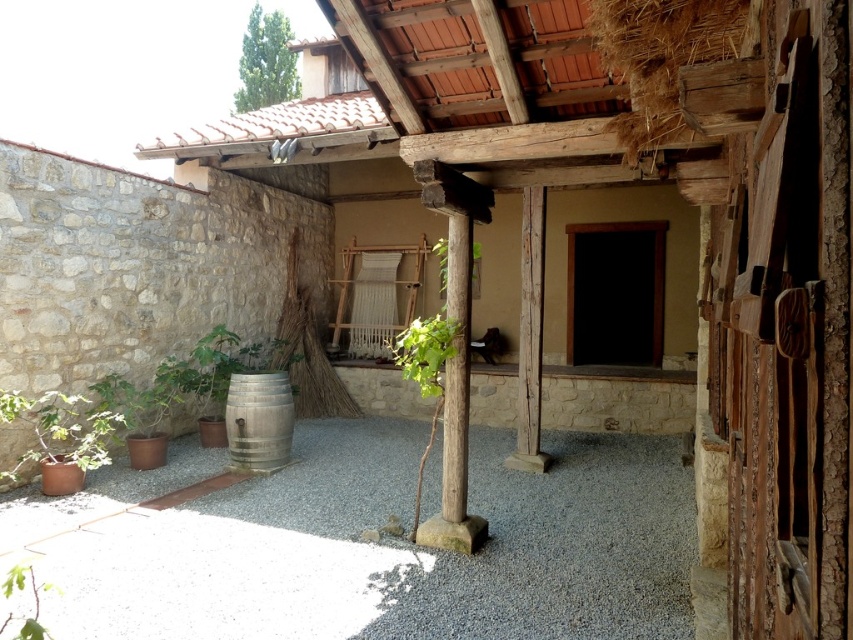
Question: Can you confirm if gray gravel at lower center is wider than green leafy plant at lower left?

Choices:
 (A) no
 (B) yes

Answer: (B)

Question: Estimate the real-world distances between objects in this image. Which object is closer to the green leafy plant at center?

Choices:
 (A) gray gravel at lower center
 (B) green leafy plant at lower left

Answer: (A)

Question: Is green leafy plant at center thinner than green leafy plant at lower left?

Choices:
 (A) yes
 (B) no

Answer: (A)

Question: Estimate the real-world distances between objects in this image. Which object is closer to the terracotta pot at lower left?

Choices:
 (A) green leafy plant at center
 (B) gray gravel at lower center
 (C) green leafy plant at lower left

Answer: (B)

Question: Does terracotta pot at lower left appear on the left side of green leafy plant at center?

Choices:
 (A) no
 (B) yes

Answer: (B)

Question: Which object is positioned closest to the green leafy plant at center?

Choices:
 (A) terracotta pot at lower left
 (B) green leafy plant at lower left

Answer: (B)